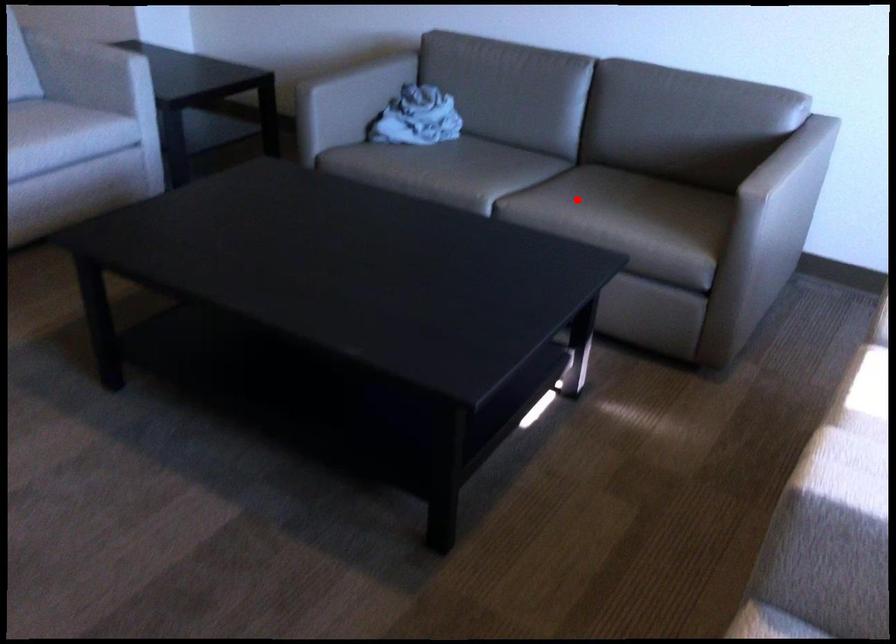
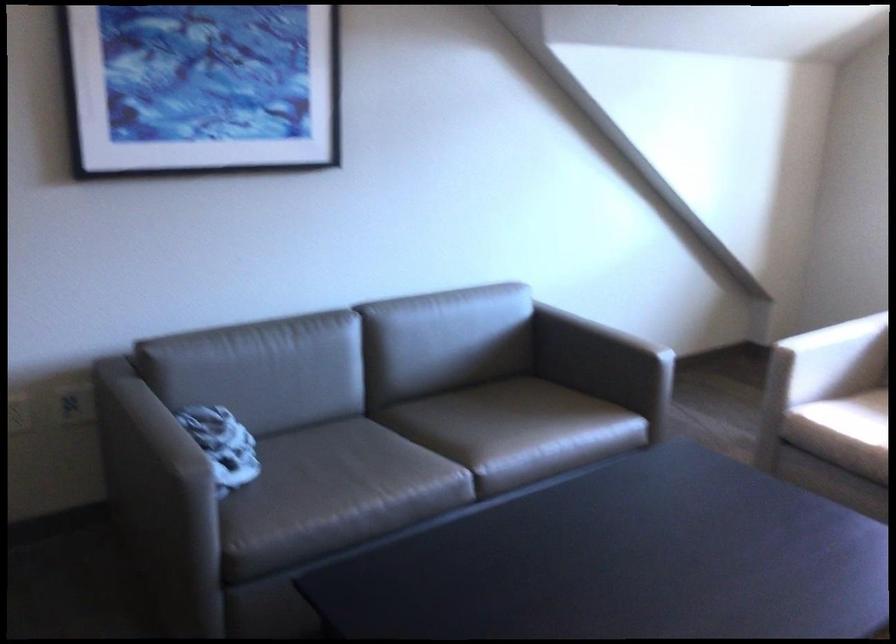
Question: I am providing you with two images of the same scene from different viewpoints. A red point is marked on the first image. Is the red point's position out of view in image 2?

Choices:
 (A) Yes
 (B) No

Answer: (B)